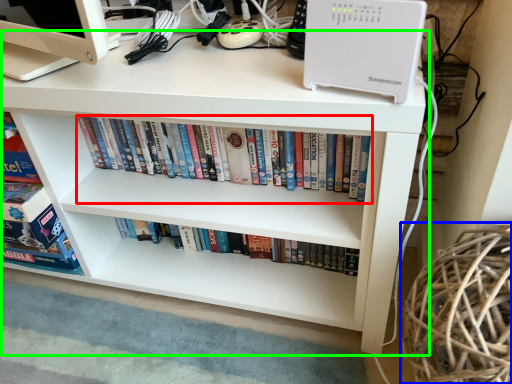
Question: Considering the real-world distances, which object is closest to book (highlighted by a red box)? basket (highlighted by a blue box) or desk (highlighted by a green box).

Choices:
 (A) basket
 (B) desk

Answer: (B)